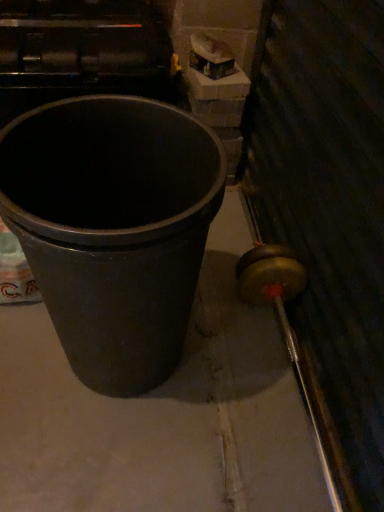
Question: Is matte black bucket at center-left further to camera compared to black plastic trash can at left?

Choices:
 (A) no
 (B) yes

Answer: (B)

Question: From a real-world perspective, is matte black bucket at center-left below black plastic trash can at left?

Choices:
 (A) no
 (B) yes

Answer: (B)

Question: Considering the relative sizes of matte black bucket at center-left and black plastic trash can at left in the image provided, is matte black bucket at center-left bigger than black plastic trash can at left?

Choices:
 (A) no
 (B) yes

Answer: (A)

Question: Is black plastic trash can at left located within matte black bucket at center-left?

Choices:
 (A) no
 (B) yes

Answer: (A)

Question: Is the position of matte black bucket at center-left less distant than that of black plastic trash can at left?

Choices:
 (A) yes
 (B) no

Answer: (B)

Question: From the image's perspective, would you say matte black bucket at center-left is positioned over black plastic trash can at left?

Choices:
 (A) no
 (B) yes

Answer: (A)

Question: Is black plastic trash can at left in contact with matte black bucket at center-left?

Choices:
 (A) yes
 (B) no

Answer: (B)

Question: Is black plastic trash can at left completely or partially outside of matte black bucket at center-left?

Choices:
 (A) no
 (B) yes

Answer: (B)

Question: From the image's perspective, is black plastic trash can at left above matte black bucket at center-left?

Choices:
 (A) yes
 (B) no

Answer: (A)

Question: Can you confirm if black plastic trash can at left is smaller than matte black bucket at center-left?

Choices:
 (A) no
 (B) yes

Answer: (A)

Question: From a real-world perspective, is black plastic trash can at left under matte black bucket at center-left?

Choices:
 (A) yes
 (B) no

Answer: (B)

Question: Considering the relative sizes of black plastic trash can at left and matte black bucket at center-left in the image provided, is black plastic trash can at left wider than matte black bucket at center-left?

Choices:
 (A) no
 (B) yes

Answer: (A)

Question: Looking at the image, does matte black bucket at center-left seem bigger or smaller compared to black plastic trash can at left?

Choices:
 (A) big
 (B) small

Answer: (B)